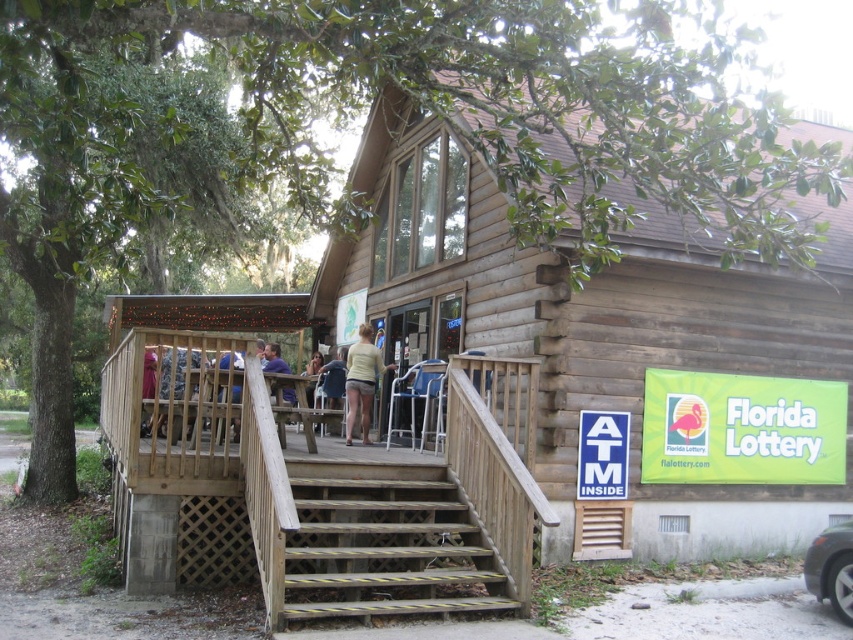
Does wooden at lower left have a lesser width compared to light yellow fabric shorts at center?

No, wooden at lower left is not thinner than light yellow fabric shorts at center.

Is wooden at lower left taller than light yellow fabric shorts at center?

Yes, wooden at lower left is taller than light yellow fabric shorts at center.

Measure the distance between point (374, 492) and camera.

Point (374, 492) is 7.12 meters away from camera.

At what (x,y) coordinates should I click in order to perform the action: click on wooden at lower left. Please return your answer as a coordinate pair (x, y). Looking at the image, I should click on (317, 499).

Is wooden cabin at center thinner than light yellow fabric shorts at center?

No, wooden cabin at center is not thinner than light yellow fabric shorts at center.

Is wooden cabin at center further to camera compared to light yellow fabric shorts at center?

No, wooden cabin at center is in front of light yellow fabric shorts at center.

Describe the element at coordinates (595, 333) in the screenshot. I see `wooden cabin at center` at that location.

Identify the location of wooden cabin at center. (595, 333).

In the scene shown: Is wooden at lower left shorter than yellow-striped wood stairs at lower center?

Incorrect, wooden at lower left's height does not fall short of yellow-striped wood stairs at lower center's.

Find the location of `wooden at lower left`. wooden at lower left is located at coordinates (317, 499).

What do you see at coordinates (317, 499) in the screenshot? I see `wooden at lower left` at bounding box center [317, 499].

Identify the location of wooden at lower left. coord(317,499).